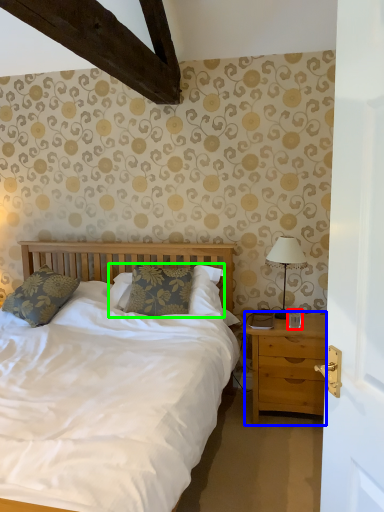
Question: Which is nearer to the coffee cup (highlighted by a red box)? nightstand (highlighted by a blue box) or pillow (highlighted by a green box).

Choices:
 (A) nightstand
 (B) pillow

Answer: (A)